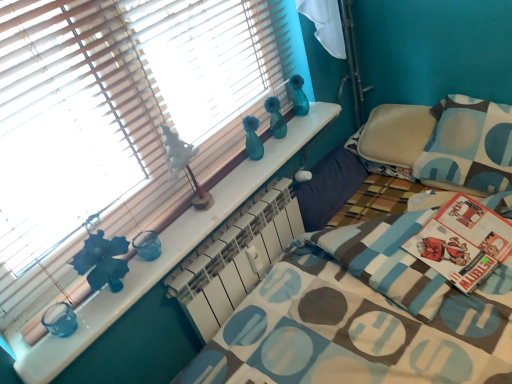
Question: Is white matte table lamp at upper center outside blue and white patterned pillow at right?

Choices:
 (A) yes
 (B) no

Answer: (A)

Question: From a real-world perspective, is white matte table lamp at upper center positioned under blue and white patterned pillow at right based on gravity?

Choices:
 (A) yes
 (B) no

Answer: (B)

Question: Does white matte table lamp at upper center lie in front of blue and white patterned pillow at right?

Choices:
 (A) no
 (B) yes

Answer: (B)

Question: Considering the relative sizes of white matte table lamp at upper center and blue and white patterned pillow at right in the image provided, is white matte table lamp at upper center bigger than blue and white patterned pillow at right?

Choices:
 (A) yes
 (B) no

Answer: (B)

Question: From a real-world perspective, is white matte table lamp at upper center positioned over blue and white patterned pillow at right based on gravity?

Choices:
 (A) yes
 (B) no

Answer: (A)

Question: Is white matte table lamp at upper center touching blue and white patterned pillow at right?

Choices:
 (A) no
 (B) yes

Answer: (A)

Question: Does blue and white patterned pillow at right come in front of white matte table lamp at upper center?

Choices:
 (A) no
 (B) yes

Answer: (A)

Question: Is blue and white patterned pillow at right positioned beyond the bounds of white matte table lamp at upper center?

Choices:
 (A) no
 (B) yes

Answer: (B)

Question: Does blue and white patterned pillow at right have a lesser height compared to white matte table lamp at upper center?

Choices:
 (A) no
 (B) yes

Answer: (A)

Question: Is blue and white patterned pillow at right surrounding white matte table lamp at upper center?

Choices:
 (A) yes
 (B) no

Answer: (B)

Question: From a real-world perspective, is blue and white patterned pillow at right over white matte table lamp at upper center?

Choices:
 (A) no
 (B) yes

Answer: (A)

Question: Does blue and white patterned pillow at right have a larger size compared to white matte table lamp at upper center?

Choices:
 (A) yes
 (B) no

Answer: (A)

Question: From the image's perspective, does white matte table lamp at upper center appear higher than wooden blinds at upper left?

Choices:
 (A) no
 (B) yes

Answer: (A)